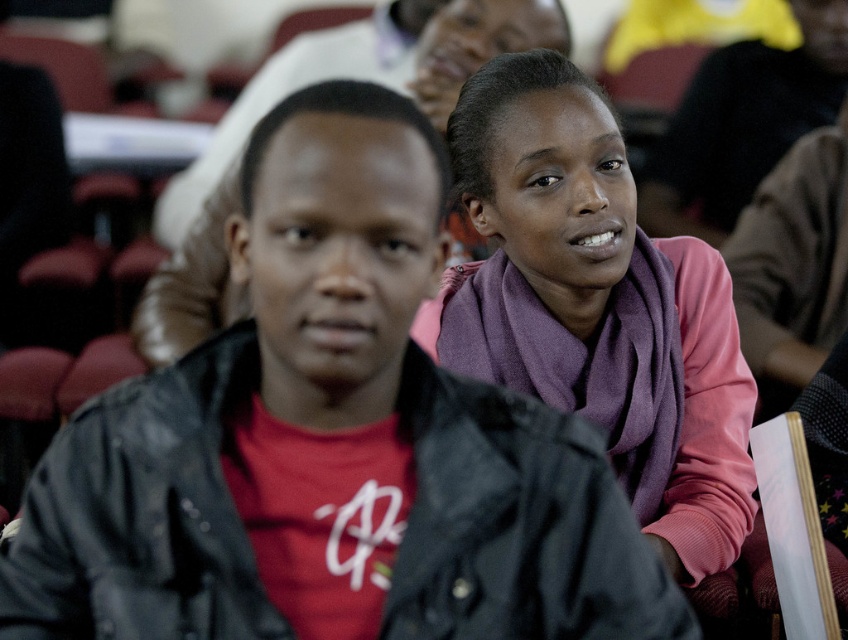
Which is more to the left, purple scarf at upper right or purple scarf at center?

purple scarf at upper right is more to the left.

Is point (413, 257) less distant than point (723, 332)?

That is True.

Locate an element on the screen. purple scarf at upper right is located at coordinates (332, 442).